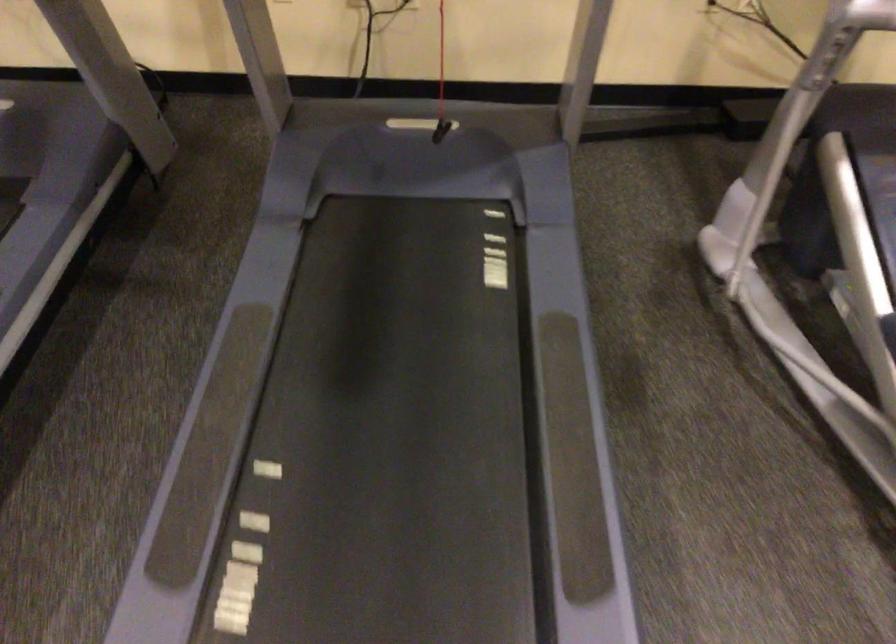
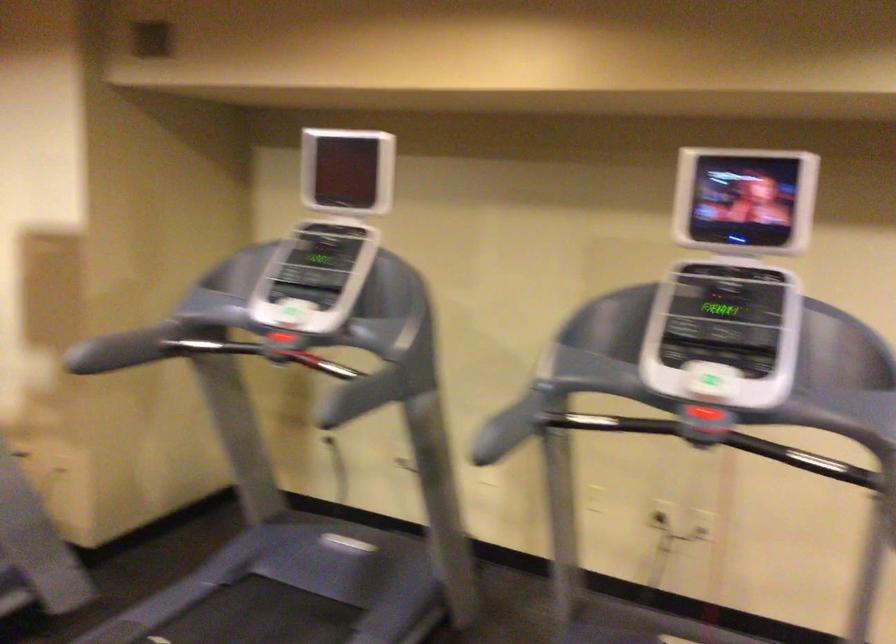
Based on the continuous images, in which direction is the camera rotating?

The camera's rotation is toward left-up.